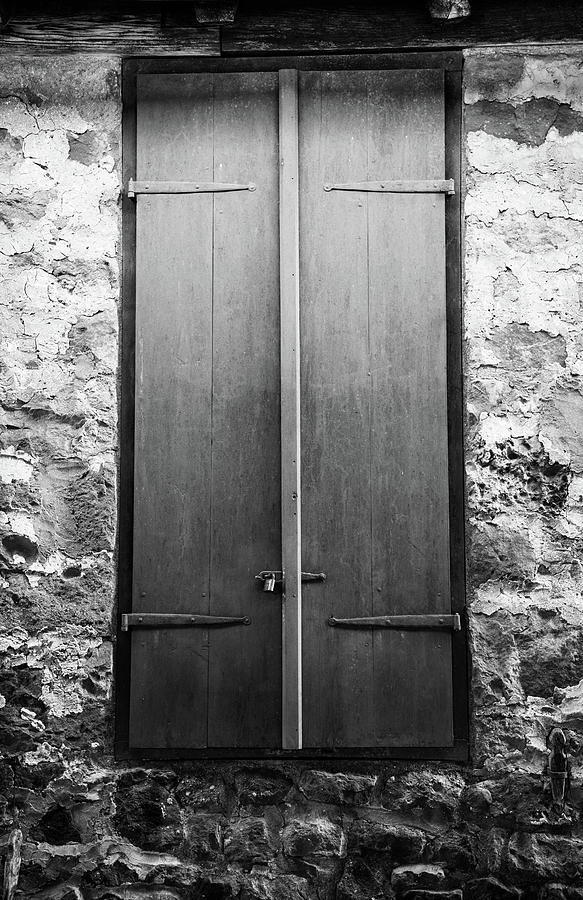
At what (x,y) coordinates should I click in order to perform the action: click on door hinges. Please return your answer as a coordinate pair (x, y). Image resolution: width=583 pixels, height=900 pixels. Looking at the image, I should click on (181, 185), (417, 622), (182, 617), (396, 185).